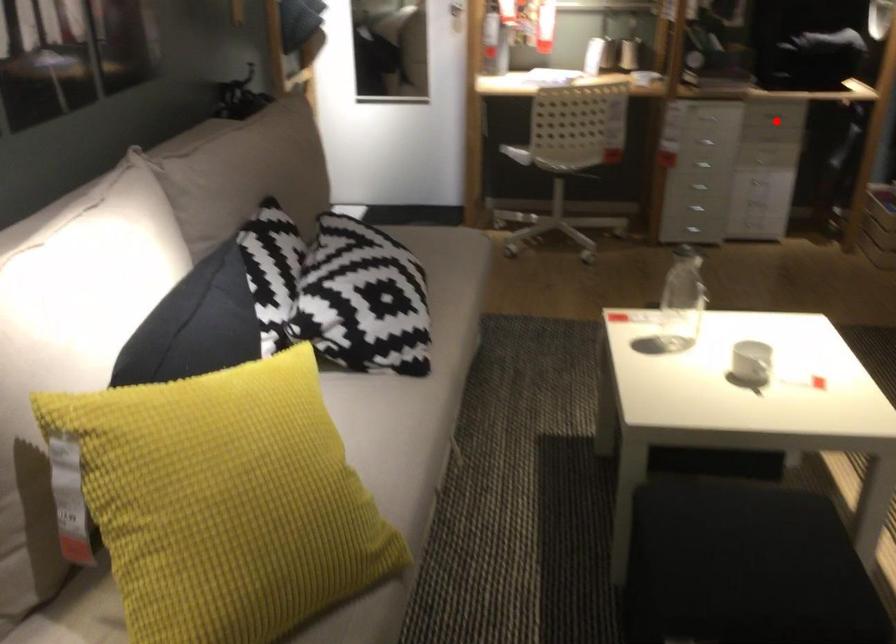
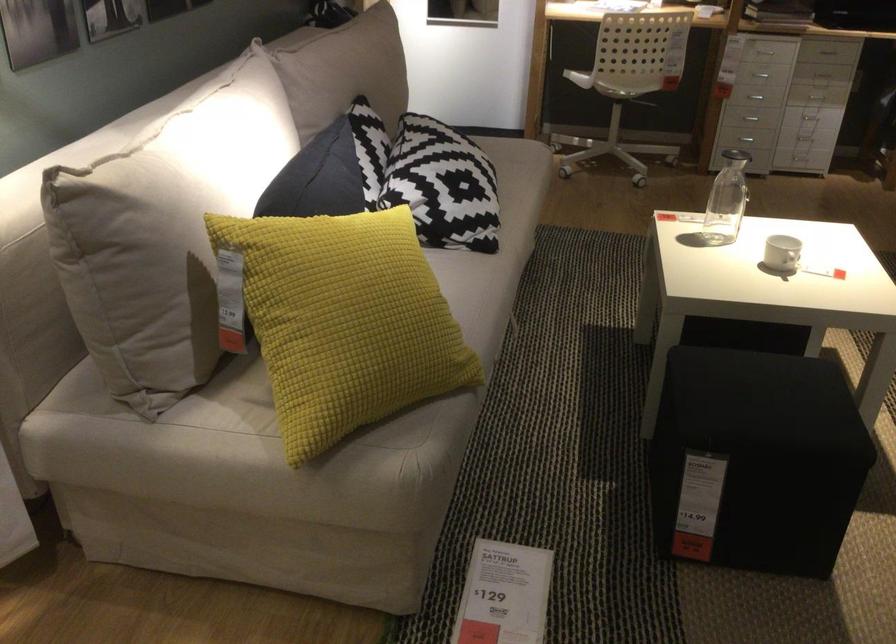
In the second image, find the point that corresponds to the highlighted location in the first image.

(826, 51)